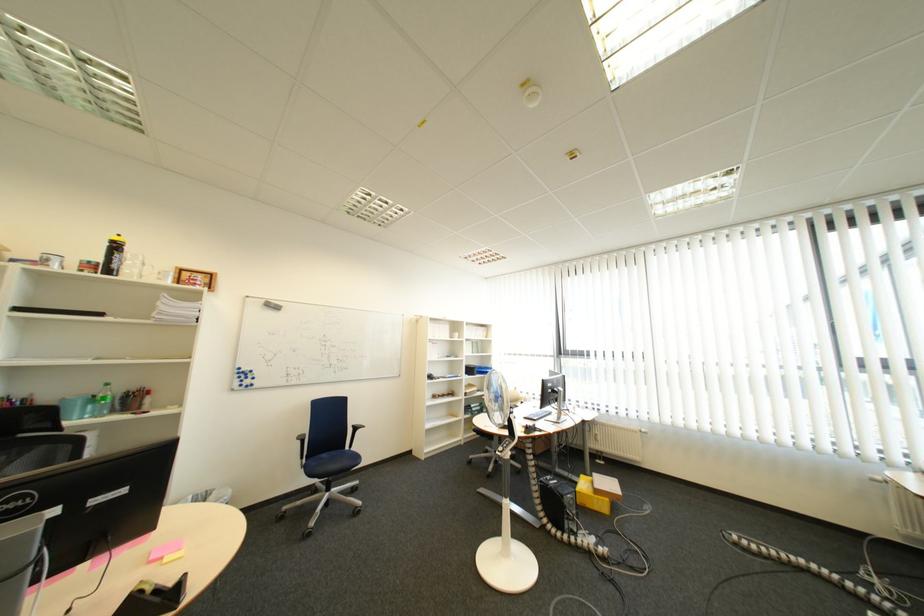
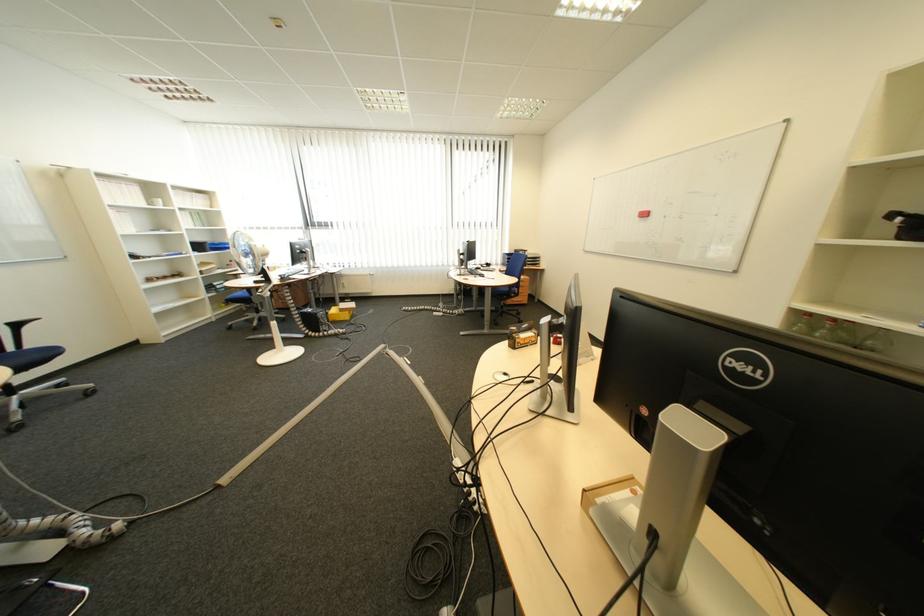
In the second image, find the point that corresponds to (x=585, y=503) in the first image.

(335, 317)